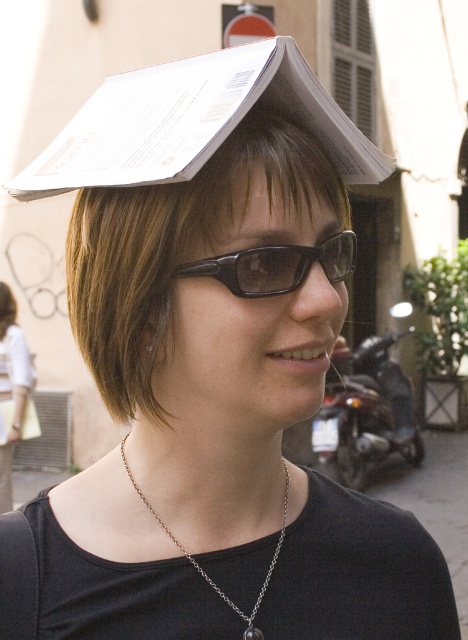
Question: Which object appears closest to the camera in this image?

Choices:
 (A) black plastic glasses at center
 (B) brown smooth hair at upper center
 (C) silver chain necklace at center

Answer: (B)

Question: Considering the real-world distances, which object is farthest from the brown smooth hair at upper center?

Choices:
 (A) black plastic glasses at center
 (B) silver chain necklace at center

Answer: (B)

Question: Is black plastic glasses at center below silver chain necklace at center?

Choices:
 (A) no
 (B) yes

Answer: (A)

Question: Which of the following is the farthest from the observer?

Choices:
 (A) silver chain necklace at center
 (B) brown smooth hair at upper center
 (C) black plastic glasses at center

Answer: (A)

Question: Does brown smooth hair at upper center have a larger size compared to silver chain necklace at center?

Choices:
 (A) yes
 (B) no

Answer: (A)

Question: Is brown smooth hair at upper center thinner than black plastic glasses at center?

Choices:
 (A) yes
 (B) no

Answer: (B)